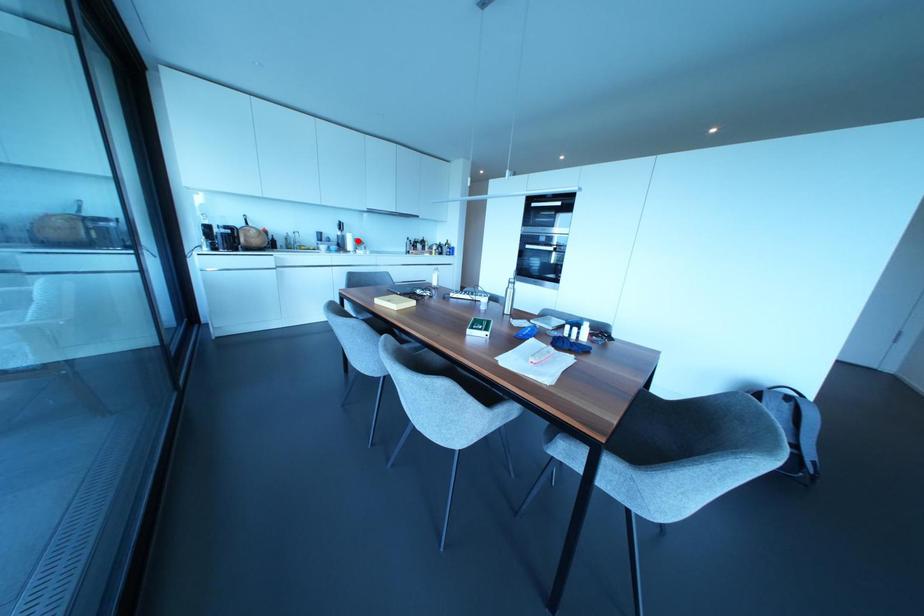
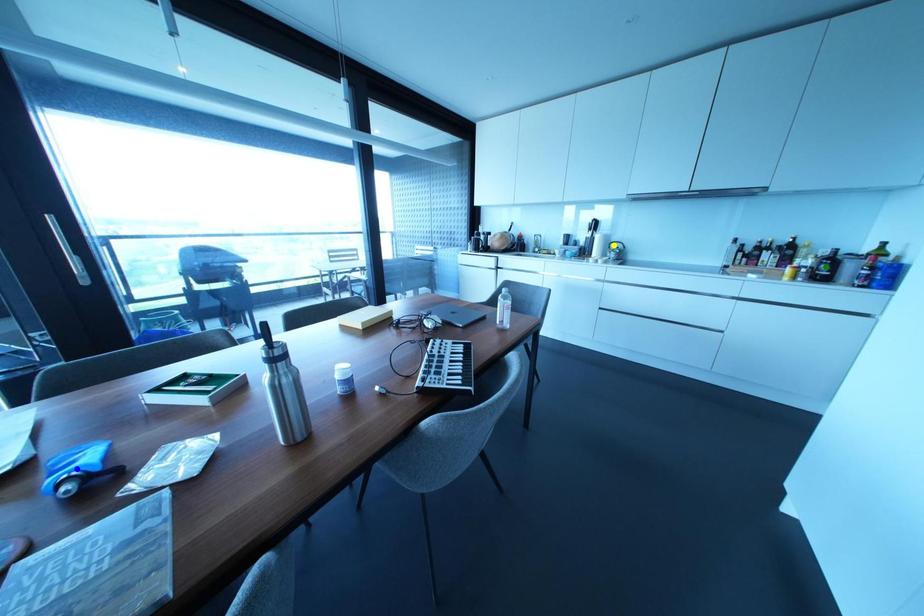
Question: I am providing you with two images of the same scene from different viewpoints. A red point is marked on the first image. You are given multiple points on the second image. Which point in image 2 represents the same 3d spot as the red point in image 1?

Choices:
 (A) yellow point
 (B) green point
 (C) blue point

Answer: (A)